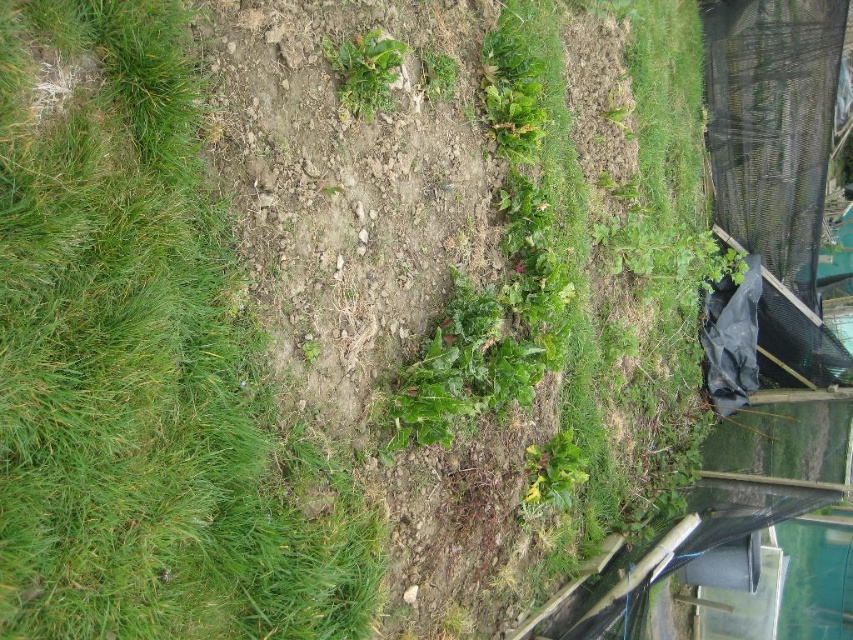
You are standing in the garden and want to reach the green leafy plant at upper center. Which direction should you move from the green grass at upper left to get there?

Since the green grass at upper left is closer to the viewer than the green leafy plant at upper center, you should move forward away from the green grass at upper left towards the green leafy plant at upper center to reach it.

You are a gardener who wants to plant a new row of herbs between the green grass at upper left and the green leafy plant at upper center. Based on their positions, which object should you start near to begin planting?

You should start near the green grass at upper left because it is positioned to the left of the green leafy plant at upper center, so planting between them would begin from the left side.

You are a gardener who wants to plant a new row of vegetables. You have two areas to choose from in the image. The first is the green grass at upper left, and the second is the green leafy plant at center. Which area has a larger space available for planting?

The green grass at upper left has a larger size compared to the green leafy plant at center, so it has more space available for planting.